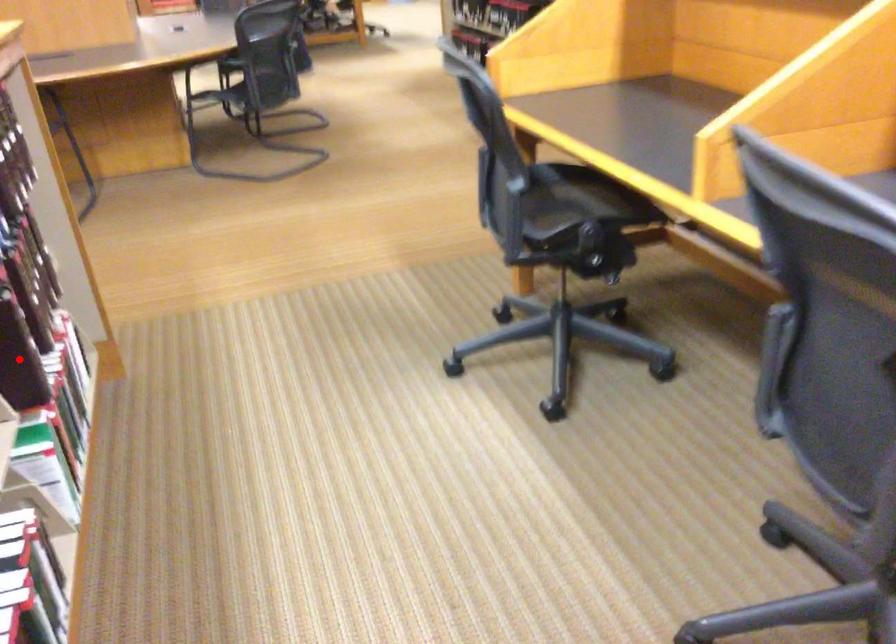
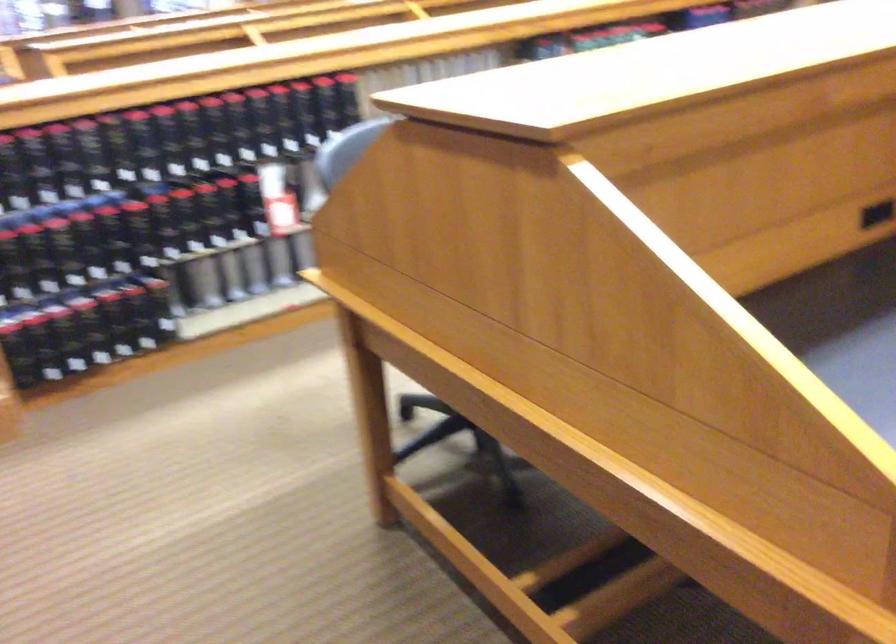
Question: I am providing you with two images of the same scene from different viewpoints. A red point is marked on the first image. Can you still see the location of the red point in image 2?

Choices:
 (A) Yes
 (B) No

Answer: (B)